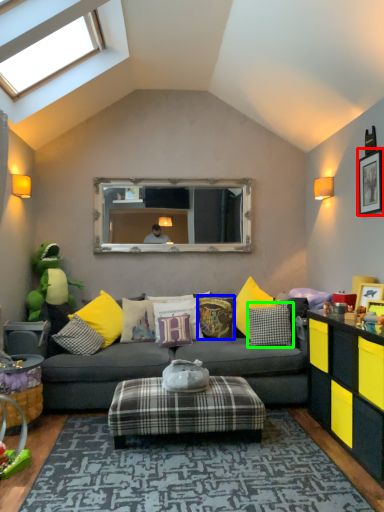
Question: Estimate the real-world distances between objects in this image. Which object is farther from picture frame (highlighted by a red box), pillow (highlighted by a blue box) or pillow (highlighted by a green box)?

Choices:
 (A) pillow
 (B) pillow

Answer: (A)